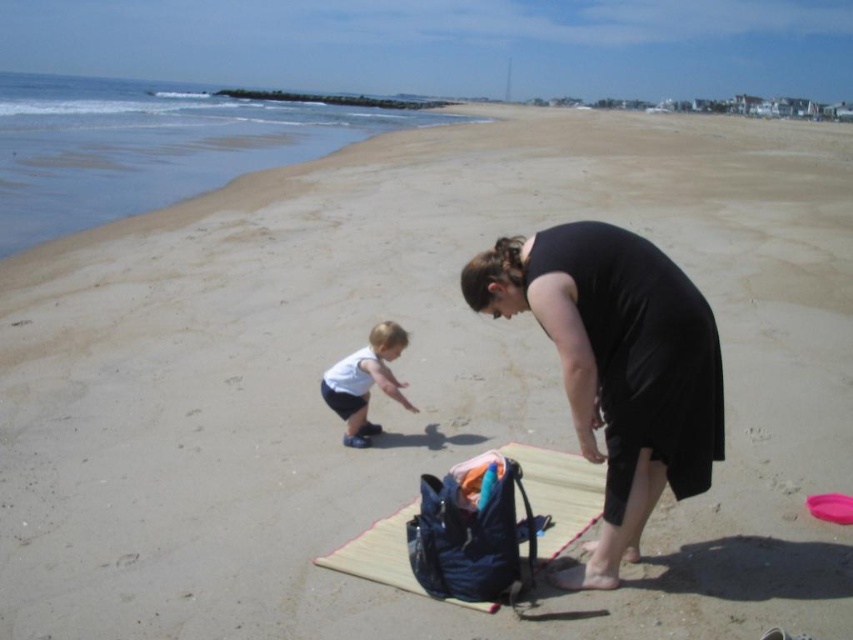
Question: Is beige woven mat at center to the right of white matte shorts at lower left from the viewer's perspective?

Choices:
 (A) no
 (B) yes

Answer: (B)

Question: Observing the image, what is the correct spatial positioning of black matte dress at center in reference to white matte shorts at lower left?

Choices:
 (A) above
 (B) below

Answer: (A)

Question: Which of the following is the closest to the observer?

Choices:
 (A) white matte shorts at lower left
 (B) black matte dress at center
 (C) beige woven mat at center

Answer: (B)

Question: Which object is farther from the camera taking this photo?

Choices:
 (A) white matte shorts at lower left
 (B) beige woven mat at center
 (C) black matte dress at center

Answer: (A)

Question: Considering the real-world distances, which object is farthest from the white matte shorts at lower left?

Choices:
 (A) beige woven mat at center
 (B) black matte dress at center

Answer: (B)

Question: Is black matte dress at center bigger than beige woven mat at center?

Choices:
 (A) yes
 (B) no

Answer: (A)